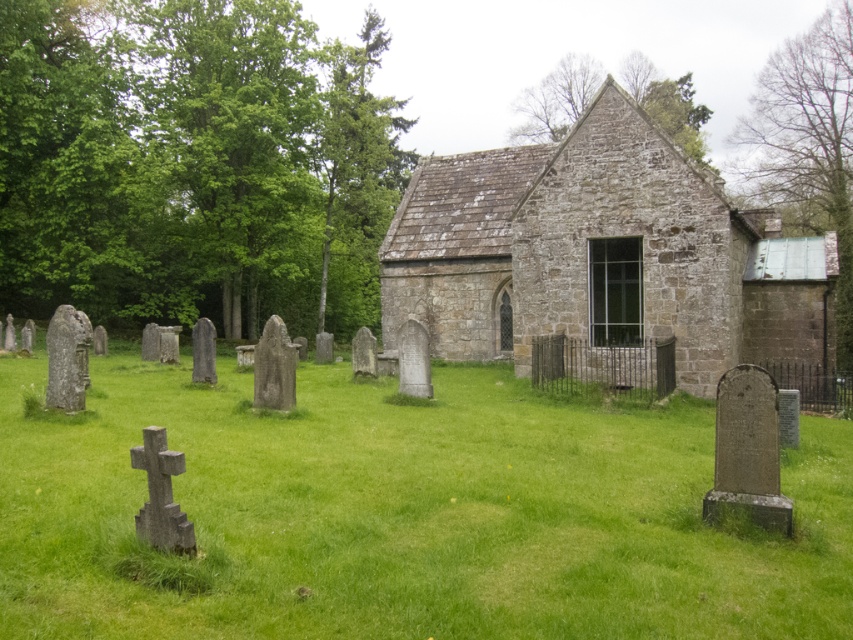
Question: Which object appears closest to the camera in this image?

Choices:
 (A) green leafy tree at upper right
 (B) gray stone cross at lower left
 (C) green grass at center

Answer: (C)

Question: Observing the image, what is the correct spatial positioning of green grass at center in reference to green leafy tree at upper right?

Choices:
 (A) left
 (B) right

Answer: (A)

Question: Based on their relative distances, which object is nearer to the green leafy tree at left?

Choices:
 (A) green textured tree at upper center
 (B) green leafy tree at upper right

Answer: (A)

Question: Considering the relative positions of stone church at center and green leafy tree at upper right in the image provided, where is stone church at center located with respect to green leafy tree at upper right?

Choices:
 (A) left
 (B) right

Answer: (A)

Question: Can you confirm if stone church at center is positioned below green leafy tree at upper right?

Choices:
 (A) no
 (B) yes

Answer: (B)

Question: Among these objects, which one is nearest to the camera?

Choices:
 (A) green leafy tree at left
 (B) gray stone cross at lower left
 (C) green grass at center
 (D) green textured tree at upper center

Answer: (C)